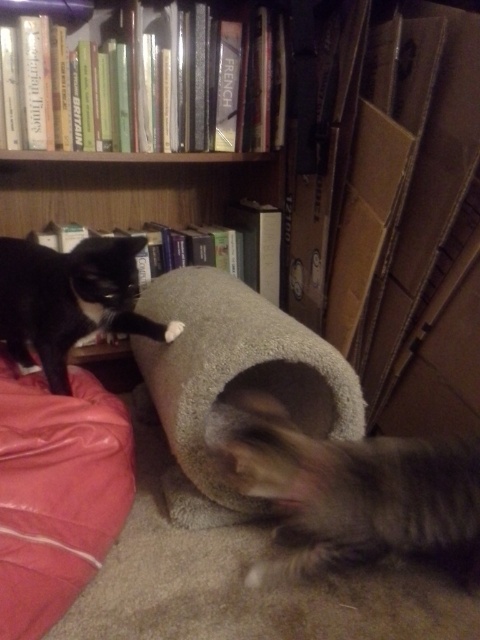
Can you confirm if soft gray carpeted tube at center is positioned to the left of black fur cat at upper left?

In fact, soft gray carpeted tube at center is to the right of black fur cat at upper left.

Is soft gray carpeted tube at center below black fur cat at upper left?

Indeed, soft gray carpeted tube at center is positioned under black fur cat at upper left.

Between point (202, 410) and point (139, 323), which one is positioned in front?

Point (202, 410)

Identify the location of soft gray carpeted tube at center. (232, 381).

Between fuzzy gray cat at lower right and black fur cat at upper left, which one is positioned higher?

black fur cat at upper left is above.

Does fuzzy gray cat at lower right appear on the left side of black fur cat at upper left?

Incorrect, fuzzy gray cat at lower right is not on the left side of black fur cat at upper left.

Which is in front, point (442, 492) or point (51, 364)?

Point (442, 492)

At what (x,y) coordinates should I click in order to perform the action: click on fuzzy gray cat at lower right. Please return your answer as a coordinate pair (x, y). Looking at the image, I should click on (348, 488).

Which is more to the left, fuzzy gray cat at lower right or wooden bookshelf at upper center?

Positioned to the left is wooden bookshelf at upper center.

This screenshot has width=480, height=640. Describe the element at coordinates (348, 488) in the screenshot. I see `fuzzy gray cat at lower right` at that location.

Where is `fuzzy gray cat at lower right`? The width and height of the screenshot is (480, 640). fuzzy gray cat at lower right is located at coordinates [348, 488].